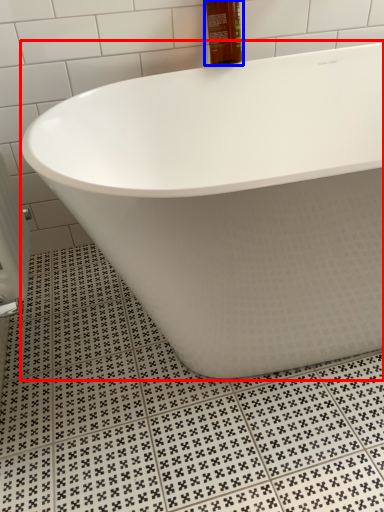
Question: Which of the following is the farthest to the observer, bathtub (highlighted by a red box) or mouthwash (highlighted by a blue box)?

Choices:
 (A) bathtub
 (B) mouthwash

Answer: (B)